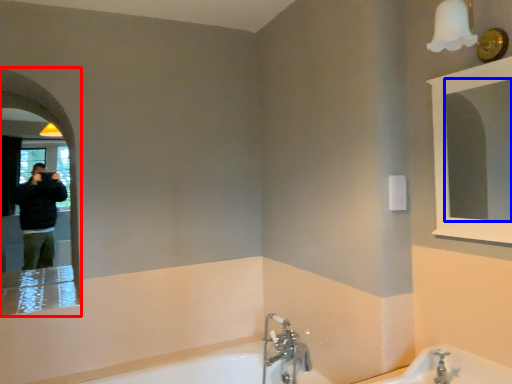
Question: Among these objects, which one is nearest to the camera, mirror (highlighted by a red box) or mirror (highlighted by a blue box)?

Choices:
 (A) mirror
 (B) mirror

Answer: (B)